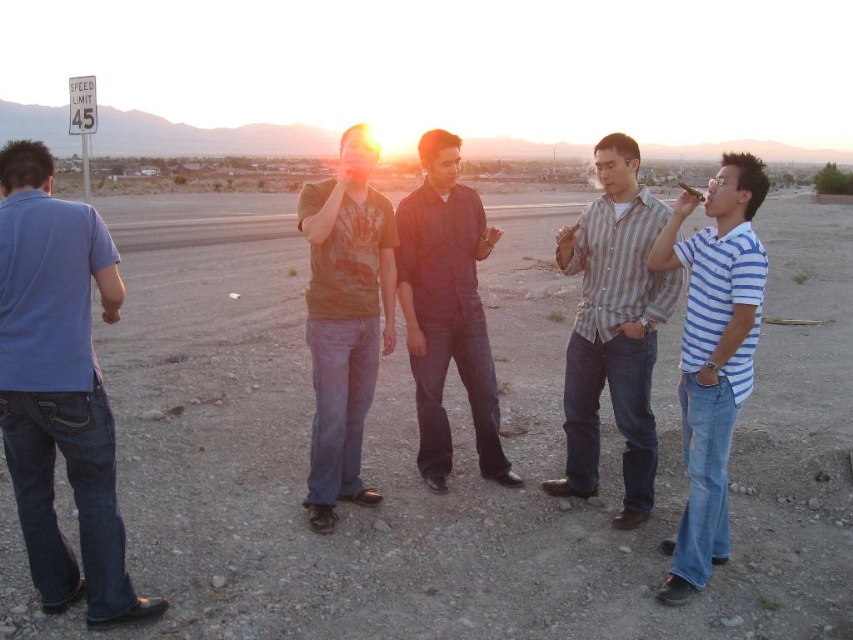
You are standing at the center of the gravelly area and want to hand a map to the person wearing the blue striped shirt at right. According to the coordinates given, in which direction should you walk to reach them?

The blue striped shirt at right is located at point (712, 355). Since the coordinates are relative to the image, moving towards the right and slightly upwards from the center would lead you to the person wearing the blue striped shirt at right.